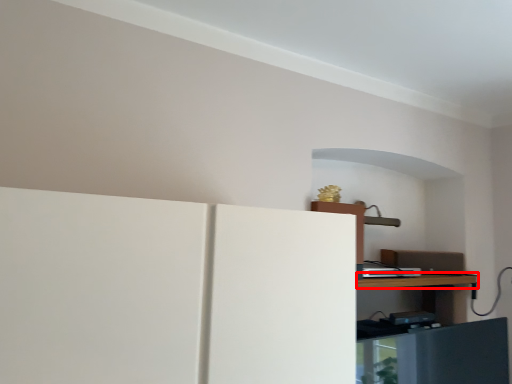
Question: From the image, what is the correct spatial relationship of table (annotated by the red box) in relation to appliance?

Choices:
 (A) left
 (B) right

Answer: (B)